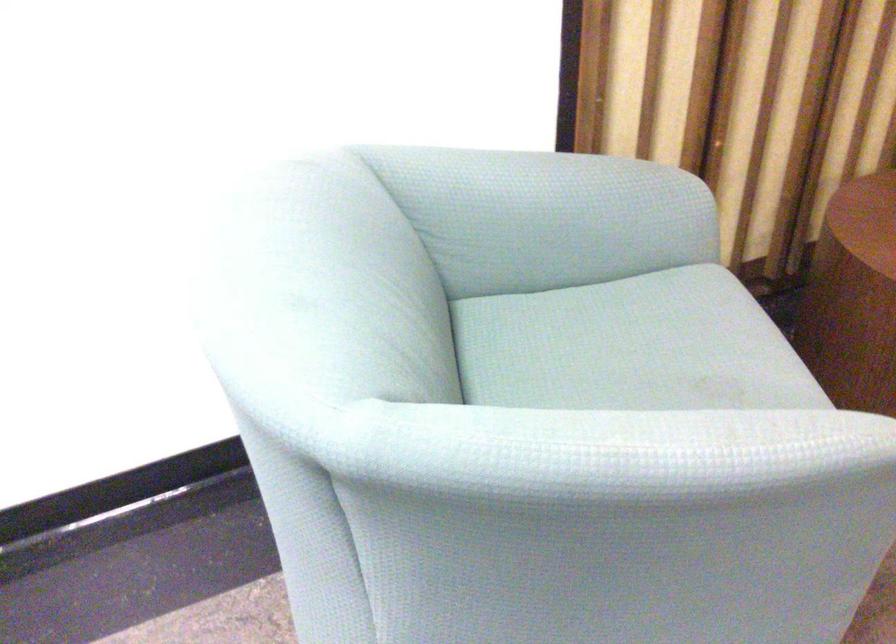
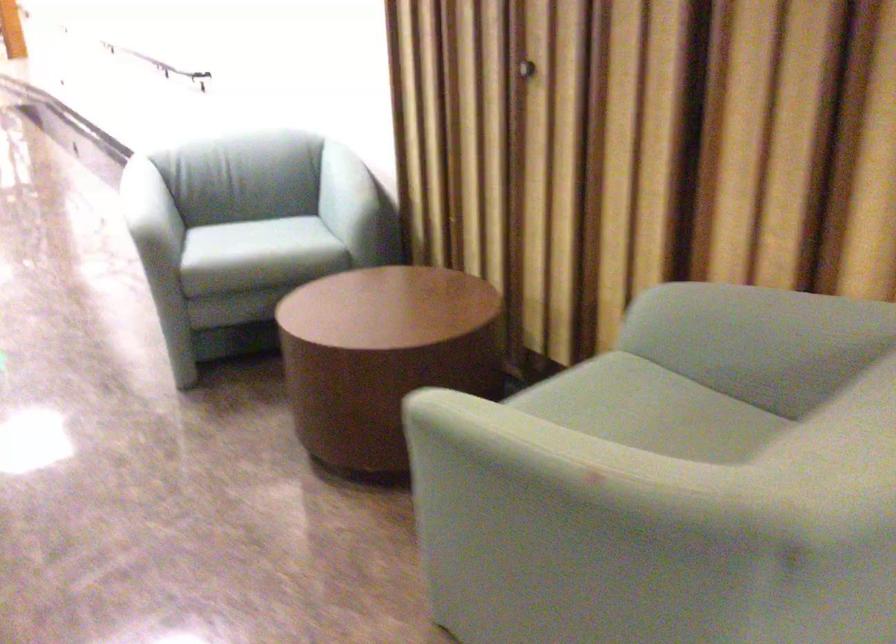
Find the pixel in the second image that matches point 719,346 in the first image.

(265, 243)